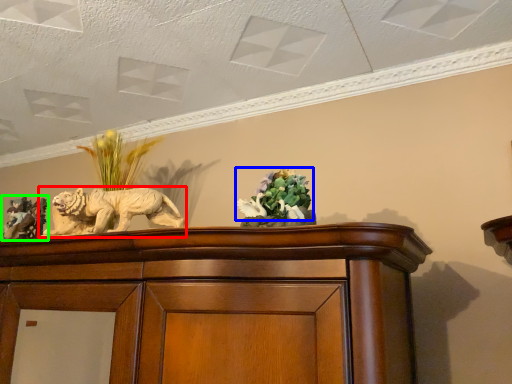
Question: Based on their relative distances, which object is nearer to lion (highlighted by a red box)? Choose from flower (highlighted by a blue box) and sculpture (highlighted by a green box).

Choices:
 (A) flower
 (B) sculpture

Answer: (B)